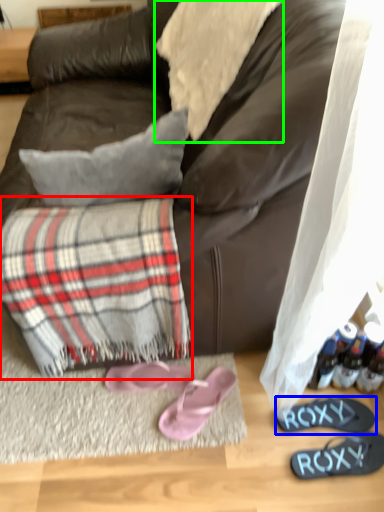
Question: Which object is the farthest from flannel (highlighted by a red box)? Choose among these: footwear (highlighted by a blue box) or cloth (highlighted by a green box).

Choices:
 (A) footwear
 (B) cloth

Answer: (B)